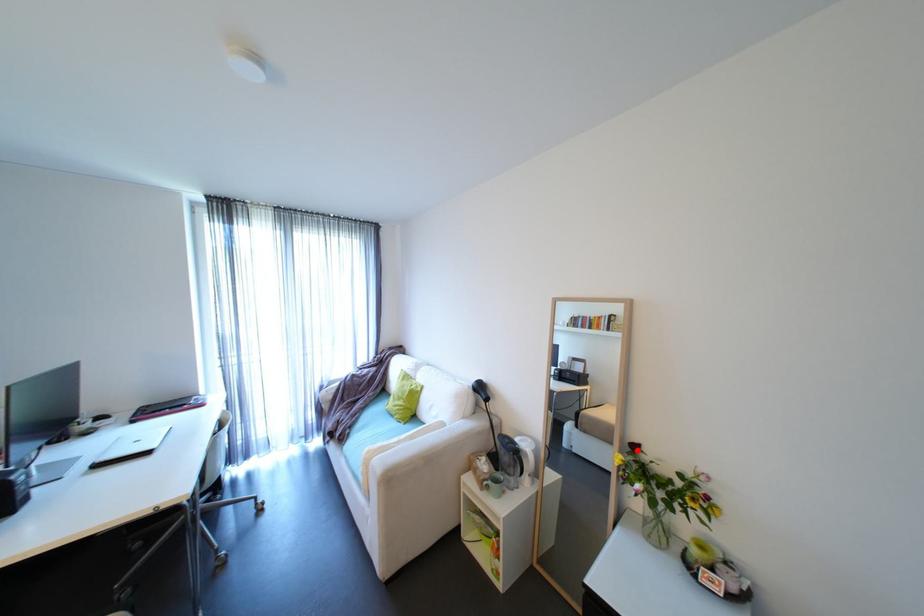
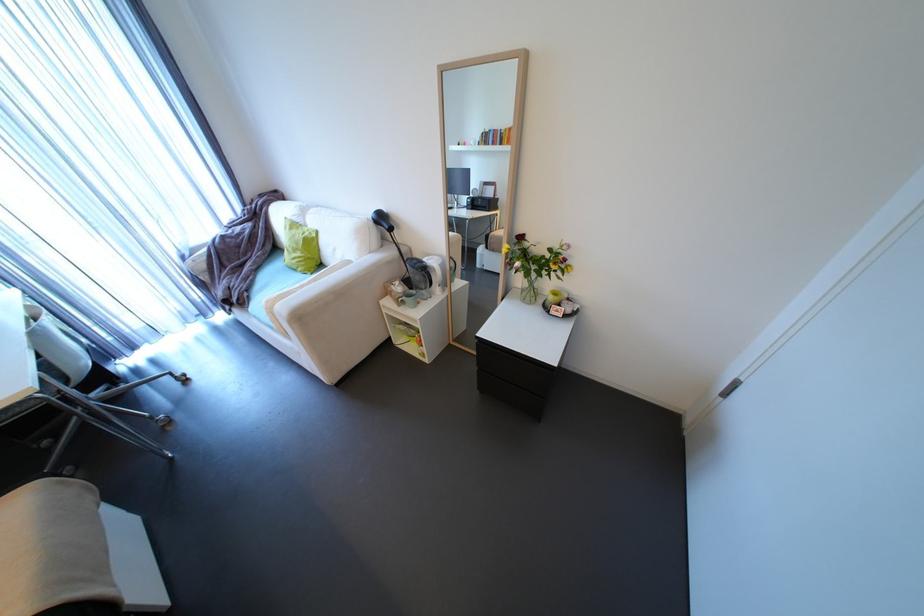
Find the pixel in the second image that matches the highlighted location in the first image.

(524, 241)